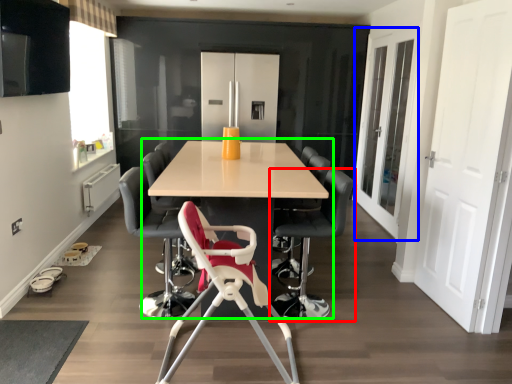
Question: Based on their relative distances, which object is farther from chair (highlighted by a red box)? Choose from glass door (highlighted by a blue box) and table (highlighted by a green box).

Choices:
 (A) glass door
 (B) table

Answer: (A)